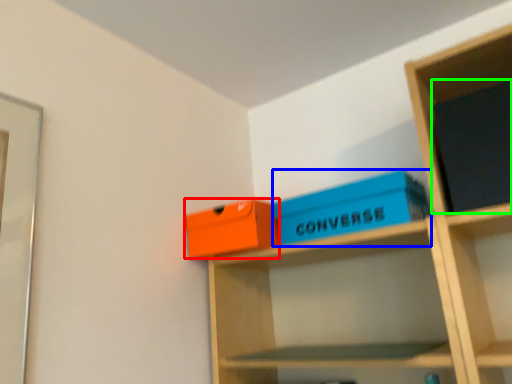
Question: Considering the real-world distances, which object is farthest from box (highlighted by a red box)? box (highlighted by a blue box) or paperback book (highlighted by a green box)?

Choices:
 (A) box
 (B) paperback book

Answer: (B)